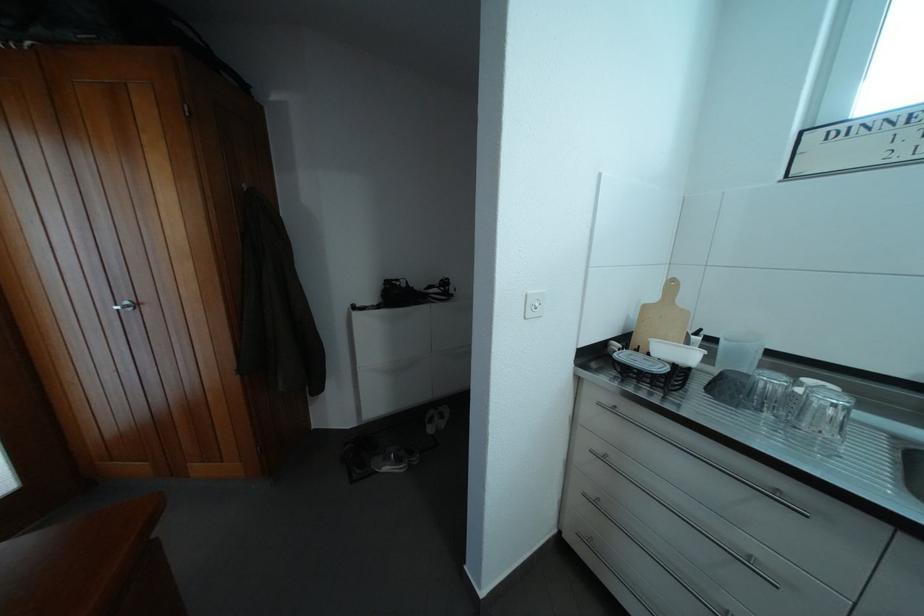
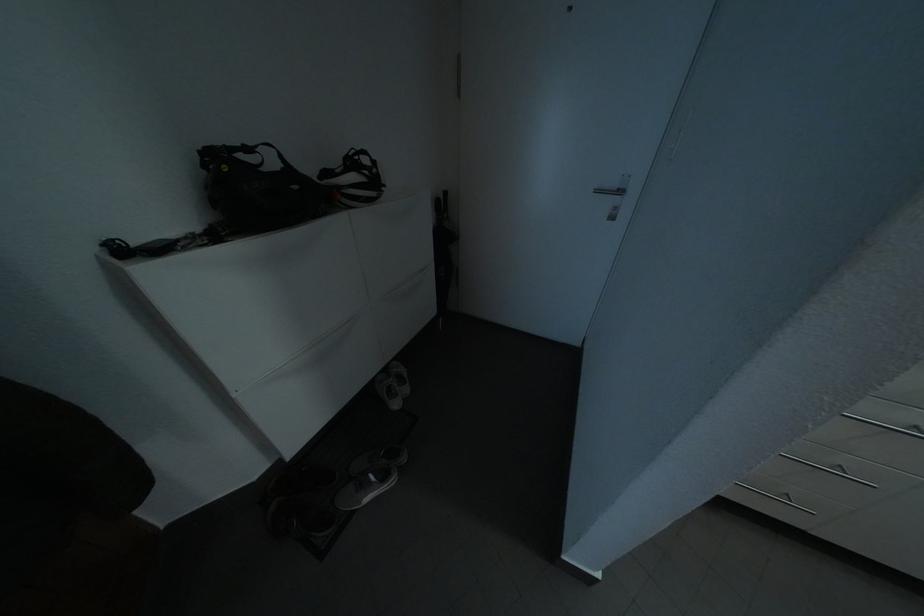
Question: I am providing you with two images of the same scene from different viewpoints. After the viewpoint changes to image2, which objects are now occluded?

Choices:
 (A) silver door handle
 (B) grey sneaker
 (C) bicycle helmet
 (D) none of these

Answer: (D)